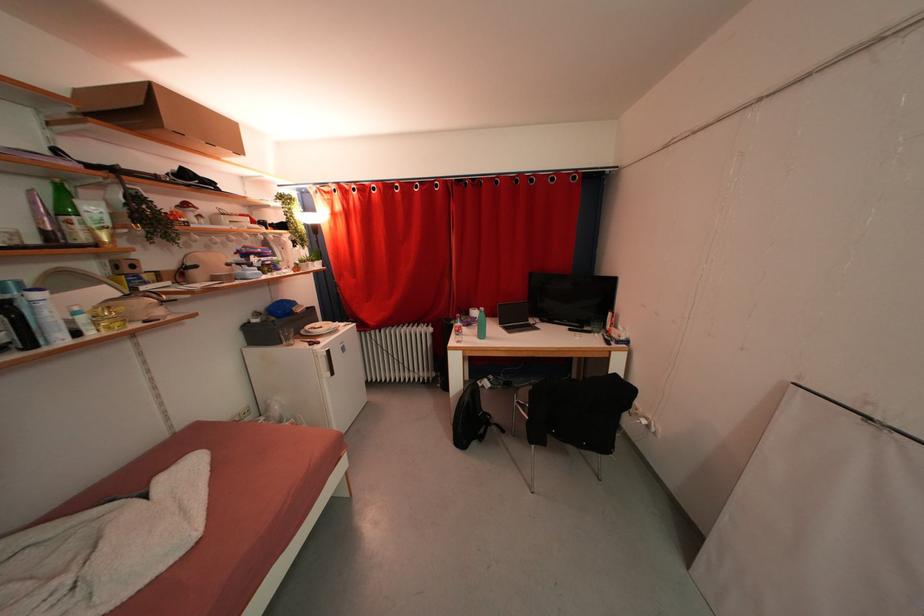
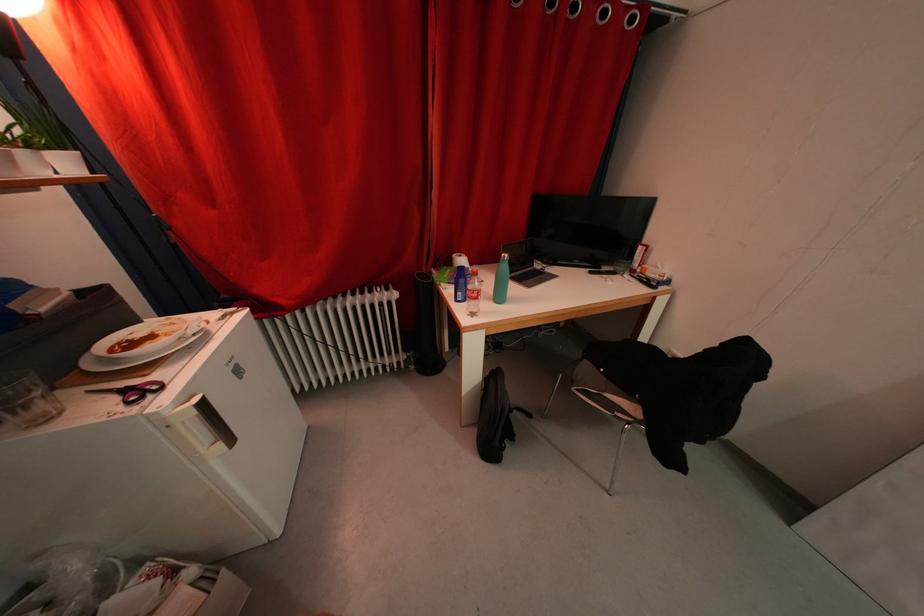
Locate, in the second image, the point that corresponds to (462,328) in the first image.

(476, 291)